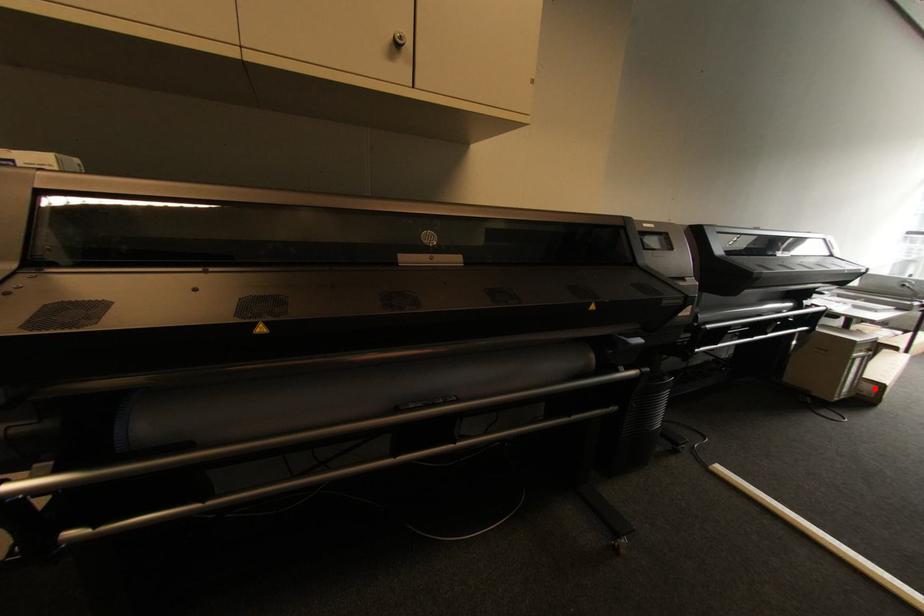
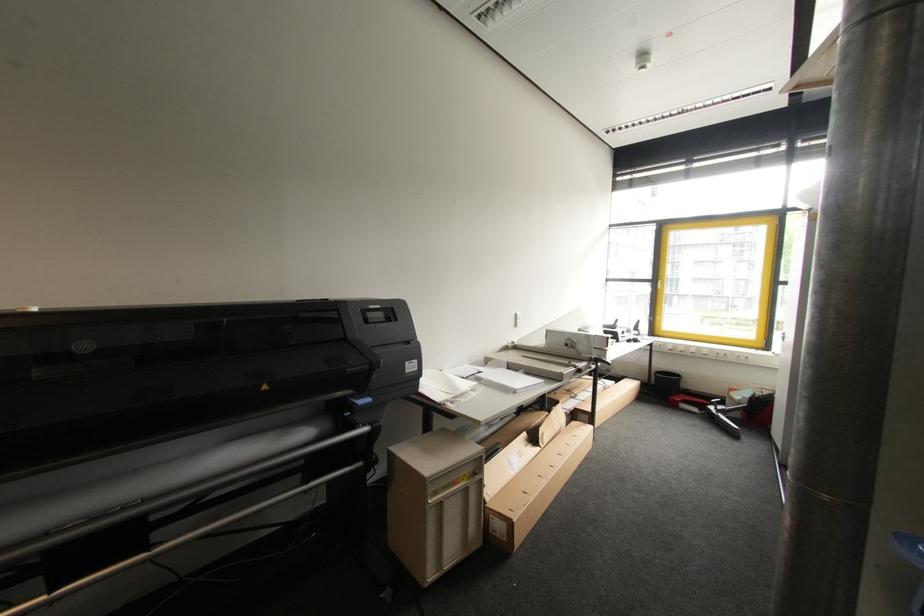
Locate, in the second image, the point that corresponds to the highlighted location in the first image.

(503, 527)